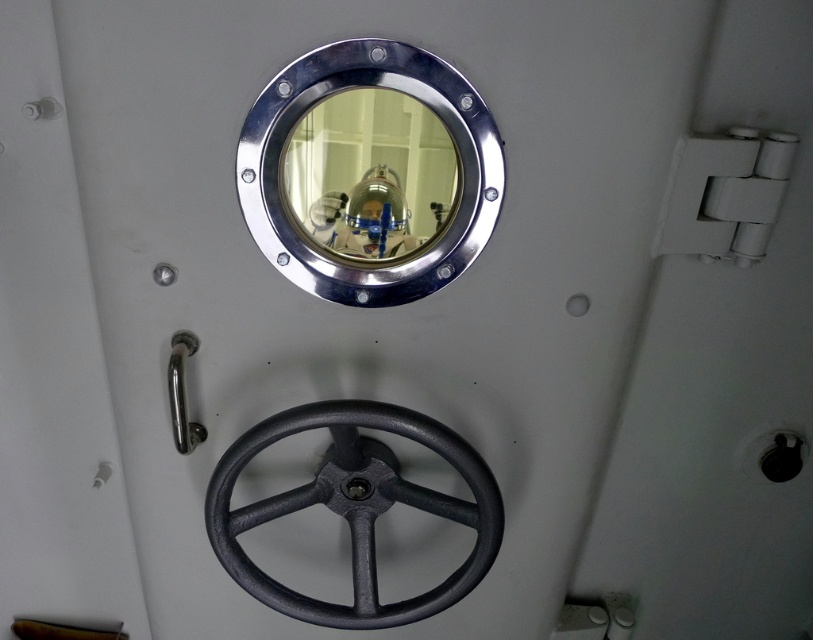
Does polished metal porthole at upper center have a smaller size compared to black cast iron wheel at lower center?

Indeed, polished metal porthole at upper center has a smaller size compared to black cast iron wheel at lower center.

Who is more distant from viewer, (362, 68) or (387, 497)?

Point (387, 497)

Does point (485, 193) come in front of point (440, 451)?

Yes, point (485, 193) is in front of point (440, 451).

You are a GUI agent. You are given a task and a screenshot of the screen. Output one action in this format:
    pyautogui.click(x=<x>, y=<y>)
    Task: Click on the polished metal porthole at upper center
    This screenshot has width=813, height=640.
    Given the screenshot: What is the action you would take?
    pyautogui.click(x=368, y=172)